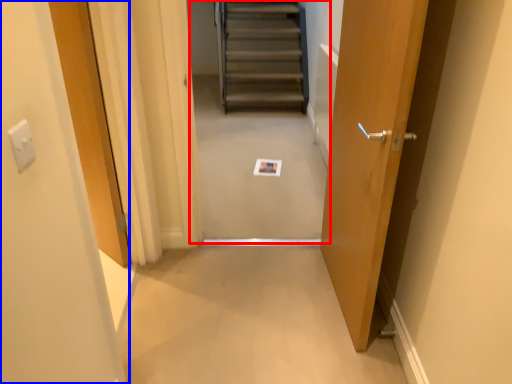
Question: Which of the following is the farthest to the observer, escalator (highlighted by a red box) or door (highlighted by a blue box)?

Choices:
 (A) escalator
 (B) door

Answer: (A)